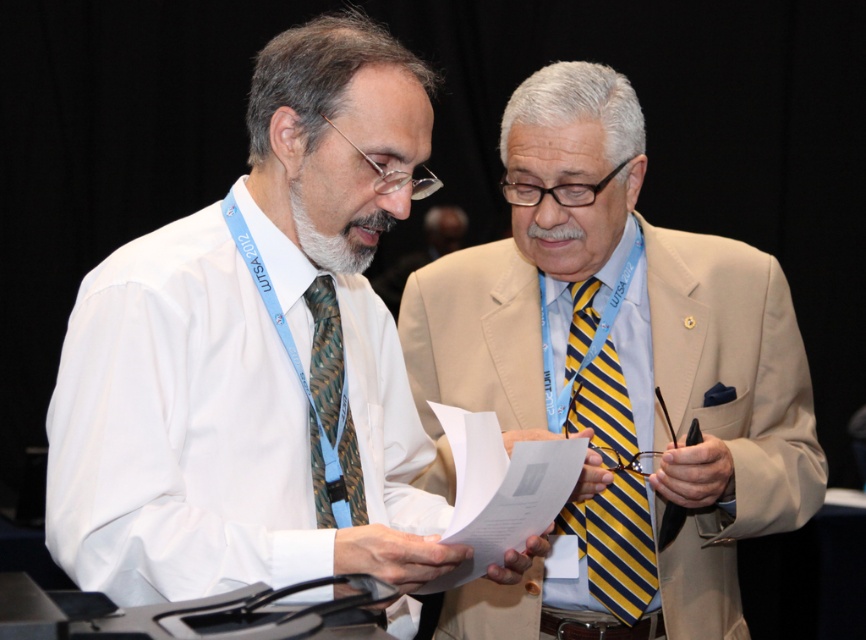
Question: Which point is farther to the camera?

Choices:
 (A) yellow striped tie at center
 (B) beige fabric suit at right
 (C) green patterned tie at left

Answer: (A)

Question: Which object appears farthest from the camera in this image?

Choices:
 (A) beige fabric suit at right
 (B) green patterned tie at left
 (C) yellow striped tie at center
 (D) white silk shirt at center

Answer: (C)

Question: Does white silk shirt at center appear over green patterned tie at left?

Choices:
 (A) yes
 (B) no

Answer: (A)

Question: Does white silk shirt at center appear over yellow striped tie at center?

Choices:
 (A) no
 (B) yes

Answer: (B)

Question: Estimate the real-world distances between objects in this image. Which object is farther from the yellow striped tie at center?

Choices:
 (A) white silk shirt at center
 (B) beige fabric suit at right

Answer: (A)

Question: Is yellow striped tie at center to the right of green patterned tie at left from the viewer's perspective?

Choices:
 (A) no
 (B) yes

Answer: (B)